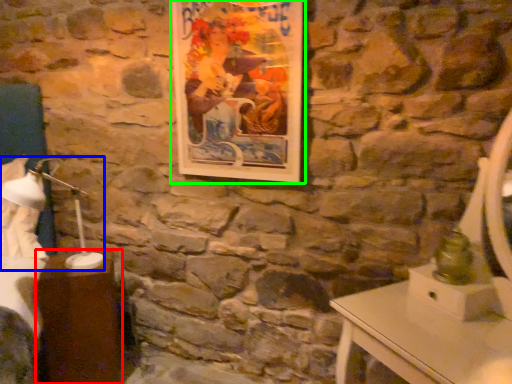
Question: Considering the real-world distances, which object is farthest from table (highlighted by a red box)? bedside lamp (highlighted by a blue box) or picture frame (highlighted by a green box)?

Choices:
 (A) bedside lamp
 (B) picture frame

Answer: (B)